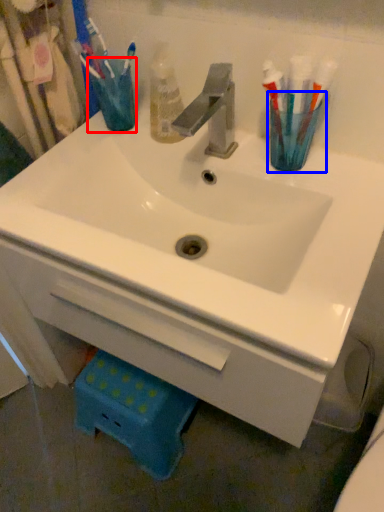
Question: Which point is further to the camera, turquoise (highlighted by a red box) or turquoise (highlighted by a blue box)?

Choices:
 (A) turquoise
 (B) turquoise

Answer: (A)